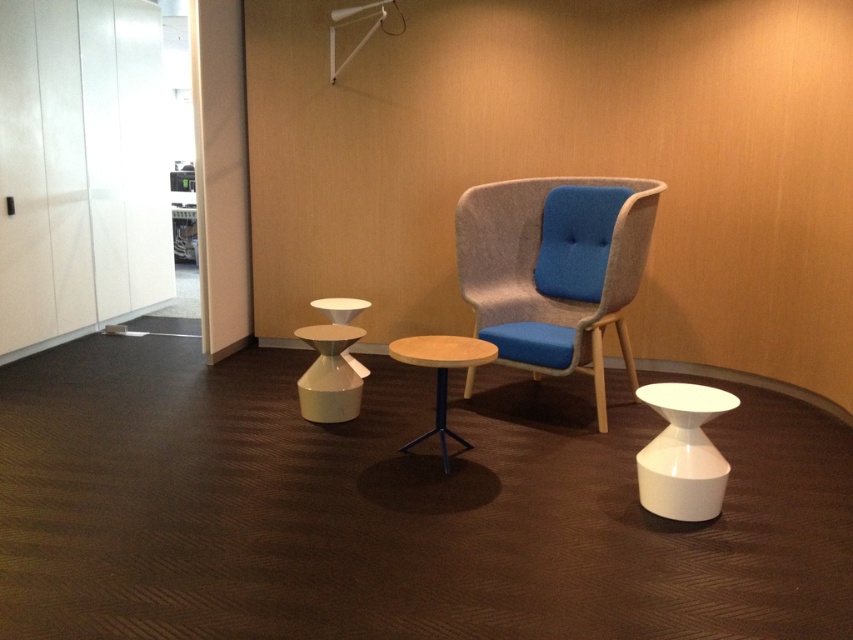
Question: Does textured wool swivel chair at center have a smaller size compared to wooden/matte side table at center?

Choices:
 (A) yes
 (B) no

Answer: (B)

Question: Estimate the real-world distances between objects in this image. Which object is farther from the wooden/matte side table at center?

Choices:
 (A) white glossy side table at center
 (B) white glossy side table at lower right
 (C) textured wool swivel chair at center

Answer: (B)

Question: Which point appears closest to the camera in this image?

Choices:
 (A) (489, 246)
 (B) (347, 364)
 (C) (705, 403)
 (D) (469, 365)

Answer: (C)

Question: Can you confirm if white glossy side table at center is wider than wooden/matte side table at center?

Choices:
 (A) no
 (B) yes

Answer: (A)

Question: Is textured wool swivel chair at center positioned at the back of wooden/matte side table at center?

Choices:
 (A) yes
 (B) no

Answer: (A)

Question: Among these points, which one is farthest from the camera?

Choices:
 (A) (680, 428)
 (B) (358, 381)

Answer: (B)